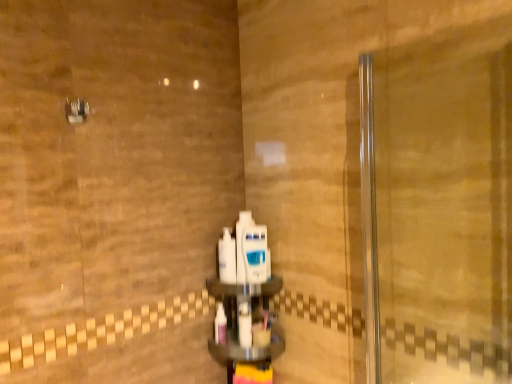
Question: From a real-world perspective, is metallic silver showerhead at upper left on white glossy mouthwash at center, arranged as the 2th mouthwash when ordered from the bottom?

Choices:
 (A) no
 (B) yes

Answer: (B)

Question: Are metallic silver showerhead at upper left and white glossy mouthwash at center, the third mouthwash in the top-to-bottom sequence, beside each other?

Choices:
 (A) yes
 (B) no

Answer: (B)

Question: Considering the relative sizes of metallic silver showerhead at upper left and white glossy mouthwash at center, arranged as the 2th mouthwash when ordered from the bottom, in the image provided, is metallic silver showerhead at upper left bigger than white glossy mouthwash at center, arranged as the 2th mouthwash when ordered from the bottom,?

Choices:
 (A) yes
 (B) no

Answer: (B)

Question: Is metallic silver showerhead at upper left further to camera compared to white glossy mouthwash at center, arranged as the 2th mouthwash when ordered from the bottom?

Choices:
 (A) yes
 (B) no

Answer: (B)

Question: Is metallic silver showerhead at upper left closer to camera compared to white glossy mouthwash at center, the third mouthwash in the top-to-bottom sequence?

Choices:
 (A) yes
 (B) no

Answer: (A)

Question: Considering the relative sizes of metallic silver showerhead at upper left and white glossy mouthwash at center, arranged as the 2th mouthwash when ordered from the bottom, in the image provided, is metallic silver showerhead at upper left smaller than white glossy mouthwash at center, arranged as the 2th mouthwash when ordered from the bottom,?

Choices:
 (A) no
 (B) yes

Answer: (B)

Question: Is white glossy mouthwash at center, arranged as the first mouthwash when viewed from the top, completely or partially inside white glossy mouthwash at center, positioned as the second mouthwash in top-to-bottom order?

Choices:
 (A) no
 (B) yes

Answer: (A)

Question: Are white glossy mouthwash at center, positioned as the second mouthwash in top-to-bottom order, and white glossy mouthwash at center, arranged as the first mouthwash when viewed from the top, far apart?

Choices:
 (A) no
 (B) yes

Answer: (A)

Question: Is white glossy mouthwash at center, positioned as the second mouthwash in top-to-bottom order, oriented towards white glossy mouthwash at center, which is the fourth mouthwash from bottom to top?

Choices:
 (A) yes
 (B) no

Answer: (A)

Question: Is white glossy mouthwash at center, arranged as the 3th mouthwash when ordered from the bottom, outside white glossy mouthwash at center, arranged as the first mouthwash when viewed from the top?

Choices:
 (A) yes
 (B) no

Answer: (A)

Question: Is white glossy mouthwash at center, arranged as the 3th mouthwash when ordered from the bottom, to the right of white glossy mouthwash at center, which is the fourth mouthwash from bottom to top, from the viewer's perspective?

Choices:
 (A) no
 (B) yes

Answer: (B)

Question: From a real-world perspective, is white glossy mouthwash at center, arranged as the 3th mouthwash when ordered from the bottom, on white glossy mouthwash at center, arranged as the first mouthwash when viewed from the top?

Choices:
 (A) no
 (B) yes

Answer: (A)

Question: Considering the relative sizes of white glossy mouthwash at center, positioned as the second mouthwash in top-to-bottom order, and white plastic mouthwash at center, positioned as the 4th mouthwash in top-to-bottom order, in the image provided, is white glossy mouthwash at center, positioned as the second mouthwash in top-to-bottom order, taller than white plastic mouthwash at center, positioned as the 4th mouthwash in top-to-bottom order,?

Choices:
 (A) no
 (B) yes

Answer: (B)